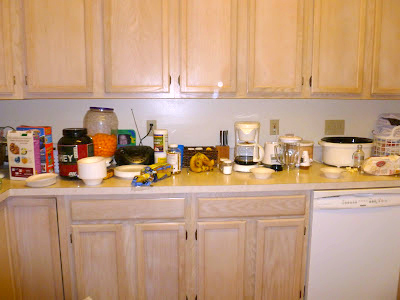
Find the location of a particular element. countertop is located at coordinates (212, 178).